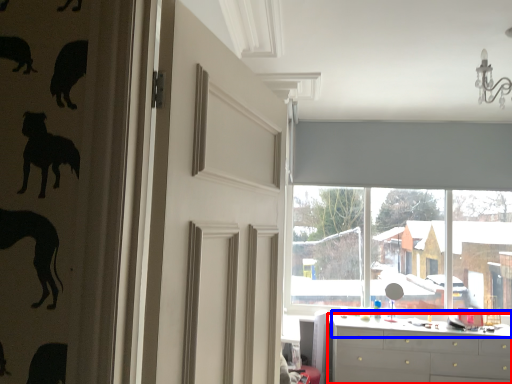
Question: Which point is closer to the camera, chest of drawers (highlighted by a red box) or counter top (highlighted by a blue box)?

Choices:
 (A) chest of drawers
 (B) counter top

Answer: (A)